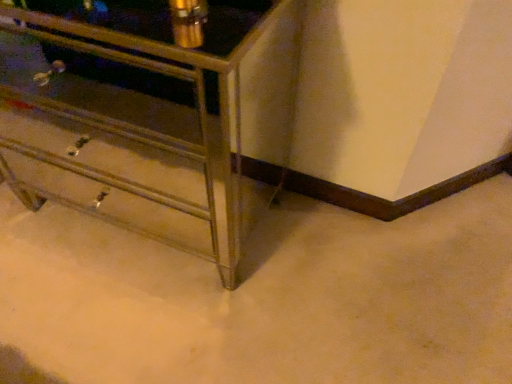
Where is `vacant space underneath metallic mirrored chest of drawers at lower left (from a real-world perspective)`? vacant space underneath metallic mirrored chest of drawers at lower left (from a real-world perspective) is located at coordinates (129, 203).